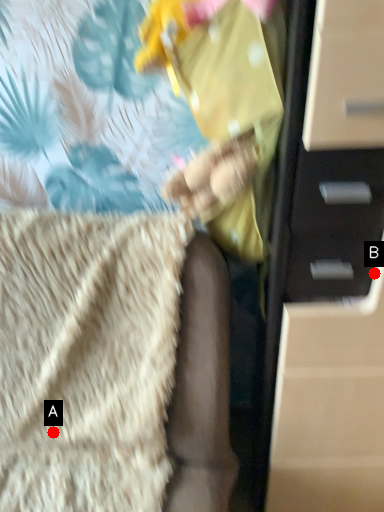
Question: Two points are circled on the image, labeled by A and B beside each circle. Which of the following is the closest to the observer?

Choices:
 (A) A is closer
 (B) B is closer

Answer: (B)